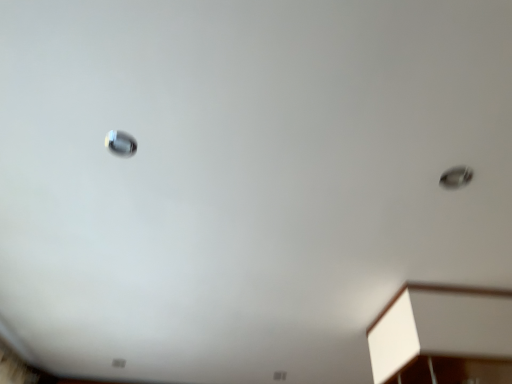
Question: From a real-world perspective, is metallic silver droplight at upper right, which is counted as the first droplight, starting from the right, under white matte cabinet at lower right?

Choices:
 (A) yes
 (B) no

Answer: (B)

Question: From the image's perspective, is metallic silver droplight at upper right, arranged as the 1th droplight when viewed from the back, on top of white matte cabinet at lower right?

Choices:
 (A) yes
 (B) no

Answer: (A)

Question: Is metallic silver droplight at upper right, which is counted as the 2th droplight, starting from the top, further to the viewer compared to white matte cabinet at lower right?

Choices:
 (A) no
 (B) yes

Answer: (A)

Question: From a real-world perspective, is metallic silver droplight at upper right, which is counted as the 2th droplight, starting from the left, physically above white matte cabinet at lower right?

Choices:
 (A) no
 (B) yes

Answer: (B)

Question: Considering the relative sizes of metallic silver droplight at upper right, which is the 2th droplight in front-to-back order, and white matte cabinet at lower right in the image provided, is metallic silver droplight at upper right, which is the 2th droplight in front-to-back order, taller than white matte cabinet at lower right?

Choices:
 (A) no
 (B) yes

Answer: (A)

Question: Choose the correct answer: Is metallic silver droplight at upper right, arranged as the 1th droplight when viewed from the back, inside satin silver droplight at upper left, which ranks as the first droplight in top-to-bottom order, or outside it?

Choices:
 (A) outside
 (B) inside

Answer: (A)

Question: From the image's perspective, relative to satin silver droplight at upper left, marked as the first droplight in a left-to-right arrangement, is metallic silver droplight at upper right, which is counted as the first droplight, starting from the right, above or below?

Choices:
 (A) above
 (B) below

Answer: (B)

Question: From a real-world perspective, is metallic silver droplight at upper right, arranged as the 1th droplight when viewed from the back, positioned above or below satin silver droplight at upper left, marked as the first droplight in a left-to-right arrangement?

Choices:
 (A) above
 (B) below

Answer: (B)

Question: Is metallic silver droplight at upper right, which is counted as the 2th droplight, starting from the left, in front of or behind satin silver droplight at upper left, positioned as the 2th droplight in bottom-to-top order, in the image?

Choices:
 (A) behind
 (B) front

Answer: (A)

Question: Visually, is metallic silver droplight at upper right, which is the 2th droplight in front-to-back order, positioned to the left or to the right of white matte cabinet at lower right?

Choices:
 (A) left
 (B) right

Answer: (A)

Question: Looking at the image, does metallic silver droplight at upper right, which is counted as the first droplight, starting from the right, seem bigger or smaller compared to white matte cabinet at lower right?

Choices:
 (A) big
 (B) small

Answer: (B)

Question: Relative to white matte cabinet at lower right, is metallic silver droplight at upper right, arranged as the 1th droplight when viewed from the back, in front or behind?

Choices:
 (A) front
 (B) behind

Answer: (A)

Question: Looking at their shapes, would you say metallic silver droplight at upper right, arranged as the 1th droplight when viewed from the back, is wider or thinner than white matte cabinet at lower right?

Choices:
 (A) wide
 (B) thin

Answer: (B)

Question: Is satin silver droplight at upper left, marked as the first droplight in a left-to-right arrangement, bigger or smaller than white matte cabinet at lower right?

Choices:
 (A) small
 (B) big

Answer: (A)

Question: Considering the positions of point (104, 140) and point (419, 375), is point (104, 140) closer or farther from the camera than point (419, 375)?

Choices:
 (A) farther
 (B) closer

Answer: (B)